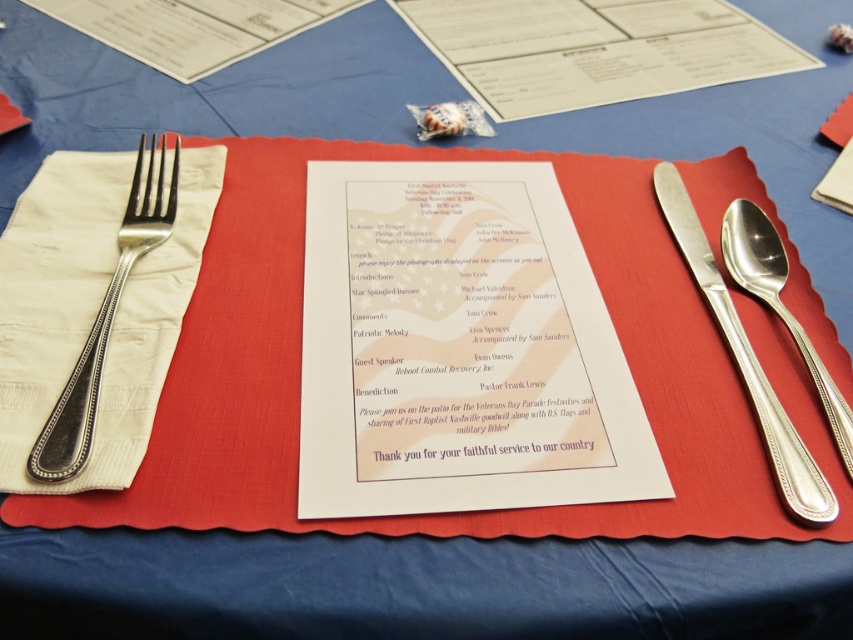
Question: Is silver polished fork at left above silver metallic knife and spoon at right?

Choices:
 (A) yes
 (B) no

Answer: (A)

Question: Among these points, which one is nearest to the camera?

Choices:
 (A) (387, 460)
 (B) (759, 256)
 (C) (74, 461)

Answer: (C)

Question: Which point appears farthest from the camera in this image?

Choices:
 (A) [846, 449]
 (B) [448, 392]
 (C) [93, 380]
 (D) [759, 419]

Answer: (D)

Question: Does silver polished fork at left have a greater width compared to silver/glossy spoon at right?

Choices:
 (A) yes
 (B) no

Answer: (A)

Question: Which of the following is the farthest from the observer?

Choices:
 (A) silver/glossy spoon at right
 (B) white paper menu at center
 (C) silver polished fork at left
 (D) silver metallic knife and spoon at right

Answer: (A)

Question: Can you confirm if silver polished fork at left is wider than silver/glossy spoon at right?

Choices:
 (A) no
 (B) yes

Answer: (B)